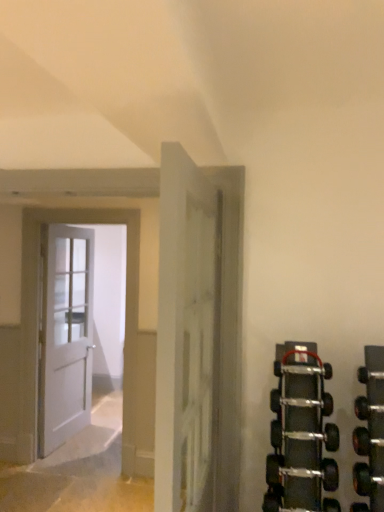
What do you see at coordinates (199, 336) in the screenshot? Image resolution: width=384 pixels, height=512 pixels. I see `white matte door at center, the 3th door in the left-to-right sequence` at bounding box center [199, 336].

Locate an element on the screen. Image resolution: width=384 pixels, height=512 pixels. white matte door at center, which ranks as the first door in front-to-back order is located at coordinates (199, 336).

You are a GUI agent. You are given a task and a screenshot of the screen. Output one action in this format:
    pyautogui.click(x=<x>, y=<y>)
    Task: Click on the white wooden door at left, the second door from the back
    This screenshot has width=384, height=512.
    Given the screenshot: What is the action you would take?
    pyautogui.click(x=37, y=320)

In order to click on white matte door at left, placed as the 1th door when sorted from back to front in this screenshot , I will do `click(66, 336)`.

From a real-world perspective, count 1st doors upward from the white matte door at left, placed as the 1th door when sorted from back to front, and point to it. Please provide its 2D coordinates.

[(37, 320)]

Considering the positions of points (32, 388) and (89, 281), is point (32, 388) farther from camera compared to point (89, 281)?

No.

Considering the sizes of objects white wooden door at left, the 2th door when ordered from right to left, and white matte door at left, placed as the 1th door when sorted from back to front, in the image provided, who is smaller, white wooden door at left, the 2th door when ordered from right to left, or white matte door at left, placed as the 1th door when sorted from back to front,?

white wooden door at left, the 2th door when ordered from right to left, is smaller.

From a real-world perspective, which is physically below, white wooden door at left, the second door from the back, or white matte door at left, the third door when ordered from right to left?

white matte door at left, the third door when ordered from right to left, is physically lower.

Considering the positions of objects white matte door at left, the 3th door when ordered from front to back, and white wooden door at left, the 2th door when ordered from right to left, in the image provided, who is in front, white matte door at left, the 3th door when ordered from front to back, or white wooden door at left, the 2th door when ordered from right to left,?

white wooden door at left, the 2th door when ordered from right to left, is in front.

Is white matte door at left, the first door positioned from the left, wider than white wooden door at left, the 2th door when ordered from right to left?

Indeed, white matte door at left, the first door positioned from the left, has a greater width compared to white wooden door at left, the 2th door when ordered from right to left.

From the image's perspective, which object appears higher, white matte door at left, the first door positioned from the left, or white wooden door at left, the 2th door from the left?

white wooden door at left, the 2th door from the left, from the image's perspective.

Would you say white matte door at left, placed as the 1th door when sorted from back to front, contains white wooden door at left, the 2th door from the left?

No.

Can you confirm if white matte door at center, which ranks as the first door in front-to-back order, is taller than white matte door at left, the first door positioned from the left?

No, white matte door at center, which ranks as the first door in front-to-back order, is not taller than white matte door at left, the first door positioned from the left.

Is white matte door at center, the 1th door viewed from the right, not near white matte door at left, placed as the 1th door when sorted from back to front?

Yes, white matte door at center, the 1th door viewed from the right, and white matte door at left, placed as the 1th door when sorted from back to front, are located far from each other.

In the scene shown: Which is in front, white matte door at center, the 3th door in the left-to-right sequence, or white matte door at left, the 3th door when ordered from front to back?

white matte door at center, the 3th door in the left-to-right sequence, is more forward.

Does white matte door at center, the 3th door in the left-to-right sequence, appear on the left side of white matte door at left, the 3th door when ordered from front to back?

No.

Is white matte door at left, the third door when ordered from right to left, facing towards white matte door at center, which ranks as the first door in front-to-back order?

No, white matte door at left, the third door when ordered from right to left, is not turned towards white matte door at center, which ranks as the first door in front-to-back order.

Considering the relative sizes of white matte door at left, placed as the 1th door when sorted from back to front, and white matte door at center, the 3th door in the left-to-right sequence, in the image provided, is white matte door at left, placed as the 1th door when sorted from back to front, wider than white matte door at center, the 3th door in the left-to-right sequence,?

Correct, the width of white matte door at left, placed as the 1th door when sorted from back to front, exceeds that of white matte door at center, the 3th door in the left-to-right sequence.

Is point (53, 359) in front of point (194, 342)?

No.

Considering the sizes of white matte door at left, placed as the 1th door when sorted from back to front, and white matte door at center, the 1th door viewed from the right, in the image, is white matte door at left, placed as the 1th door when sorted from back to front, bigger or smaller than white matte door at center, the 1th door viewed from the right,?

white matte door at left, placed as the 1th door when sorted from back to front, is bigger than white matte door at center, the 1th door viewed from the right.

Does white wooden door at left, the second door from the back, have a greater height compared to white matte door at center, which ranks as the first door in front-to-back order?

Yes, white wooden door at left, the second door from the back, is taller than white matte door at center, which ranks as the first door in front-to-back order.

From a real-world perspective, between white wooden door at left, the 2th door when ordered from right to left, and white matte door at center, which ranks as the first door in front-to-back order, who is vertically lower?

From a 3D spatial view, white wooden door at left, the 2th door when ordered from right to left, is below.

Which object is wider, white wooden door at left, the 2th door when ordered from right to left, or white matte door at center, the 1th door viewed from the right?

With larger width is white matte door at center, the 1th door viewed from the right.

Is white wooden door at left, the second door from the back, to the right of white matte door at center, which ranks as the first door in front-to-back order, from the viewer's perspective?

No.

From a real-world perspective, relative to white wooden door at left, the second door from the back, is white matte door at center, which ranks as the first door in front-to-back order, vertically above or below?

white matte door at center, which ranks as the first door in front-to-back order, is above white wooden door at left, the second door from the back.

From the image's perspective, relative to white wooden door at left, the second door from the back, is white matte door at center, which ranks as the first door in front-to-back order, above or below?

white matte door at center, which ranks as the first door in front-to-back order, is above white wooden door at left, the second door from the back.

Which door is the 1st one when counting from the back of the white matte door at center, which ranks as the first door in front-to-back order? Please provide its 2D coordinates.

[(37, 320)]

Starting from the white matte door at left, the third door when ordered from right to left, which door is the 1st one in front? Please provide its 2D coordinates.

[(37, 320)]

I want to click on door below the white wooden door at left, marked as the 2th door in a front-to-back arrangement (from a real-world perspective), so click(x=66, y=336).

From the image, which object appears to be farther from white wooden door at left, marked as the 2th door in a front-to-back arrangement, white matte door at center, the 3th door in the left-to-right sequence, or white matte door at left, the first door positioned from the left?

white matte door at center, the 3th door in the left-to-right sequence, lies further to white wooden door at left, marked as the 2th door in a front-to-back arrangement, than the other object.

Estimate the real-world distances between objects in this image. Which object is further from white wooden door at left, the 2th door when ordered from right to left, white matte door at left, the 3th door when ordered from front to back, or white matte door at center, the 3th door from the back?

The object further to white wooden door at left, the 2th door when ordered from right to left, is white matte door at center, the 3th door from the back.

When comparing their distances from white matte door at center, the 3th door from the back, does white matte door at left, the third door when ordered from right to left, or white wooden door at left, the 2th door when ordered from right to left, seem further?

white matte door at left, the third door when ordered from right to left, lies further to white matte door at center, the 3th door from the back, than the other object.

Considering their positions, is white matte door at center, which ranks as the first door in front-to-back order, positioned further to white matte door at left, the 3th door when ordered from front to back, than white wooden door at left, the 2th door from the left?

The object further to white matte door at left, the 3th door when ordered from front to back, is white matte door at center, which ranks as the first door in front-to-back order.

Based on their spatial positions, is white wooden door at left, the 2th door from the left, or white matte door at center, which ranks as the first door in front-to-back order, closer to white matte door at left, the 3th door when ordered from front to back?

The object closer to white matte door at left, the 3th door when ordered from front to back, is white wooden door at left, the 2th door from the left.

Which object lies further to the anchor point white matte door at center, the 3th door in the left-to-right sequence, white wooden door at left, marked as the 2th door in a front-to-back arrangement, or white matte door at left, the third door when ordered from right to left?

Among the two, white matte door at left, the third door when ordered from right to left, is located further to white matte door at center, the 3th door in the left-to-right sequence.

Image resolution: width=384 pixels, height=512 pixels. I want to click on door positioned between white matte door at center, the 3th door in the left-to-right sequence, and white matte door at left, placed as the 1th door when sorted from back to front, from near to far, so click(37, 320).